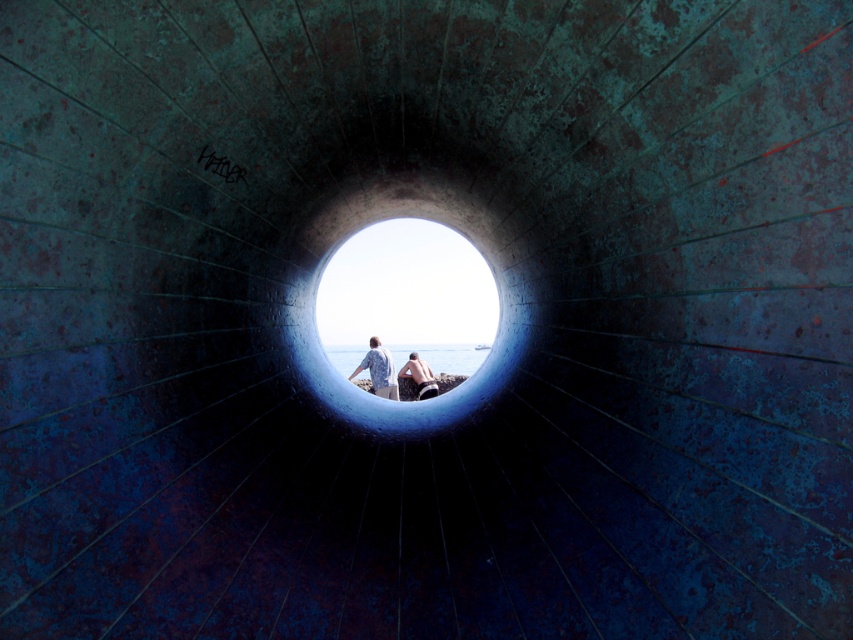
Does smooth concrete hole at center appear on the left side of blue printed shirt at center?

Incorrect, smooth concrete hole at center is not on the left side of blue printed shirt at center.

Between smooth concrete hole at center and blue printed shirt at center, which one appears on the right side from the viewer's perspective?

From the viewer's perspective, smooth concrete hole at center appears more on the right side.

Is point (450, 369) farther from camera compared to point (376, 381)?

That is True.

You are a GUI agent. You are given a task and a screenshot of the screen. Output one action in this format:
    pyautogui.click(x=<x>, y=<y>)
    Task: Click on the smooth concrete hole at center
    Image resolution: width=853 pixels, height=640 pixels.
    Given the screenshot: What is the action you would take?
    pyautogui.click(x=407, y=298)

Can you confirm if smooth concrete hole at center is positioned above smooth skin person at center?

Correct, smooth concrete hole at center is located above smooth skin person at center.

Is point (346, 288) less distant than point (413, 376)?

No, (346, 288) is behind (413, 376).

I want to click on smooth concrete hole at center, so click(407, 298).

Between blue printed shirt at center and smooth skin person at center, which one has more height?

Standing taller between the two is blue printed shirt at center.

What do you see at coordinates (378, 369) in the screenshot?
I see `blue printed shirt at center` at bounding box center [378, 369].

Locate an element on the screen. blue printed shirt at center is located at coordinates (378, 369).